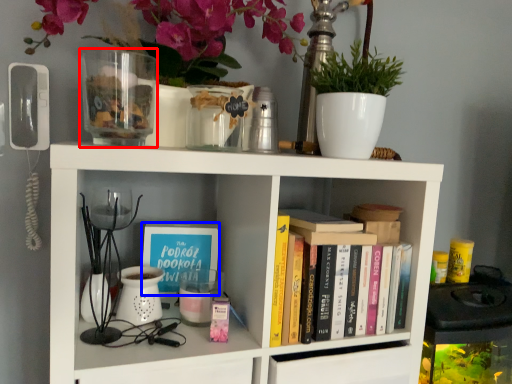
Question: Which point is closer to the camera, glass vase (highlighted by a red box) or book cover (highlighted by a blue box)?

Choices:
 (A) glass vase
 (B) book cover

Answer: (A)